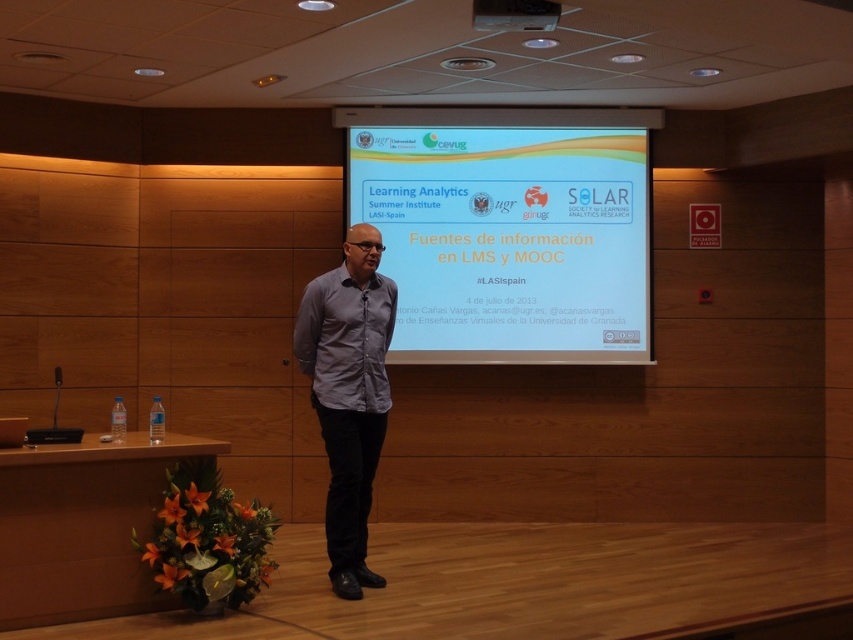
You are an event organizer setting up the conference room. The white glossy projector screen at center and the matte black projector at upper center are both mounted on the wall. Which object is wider?

The white glossy projector screen at center is wider than the matte black projector at upper center.

You are sitting in the audience and want to see both the white glossy projector screen at center and the gray matte shirt at center. Which one appears closer to you?

The white glossy projector screen at center appears closer to you than the gray matte shirt at center because it is further to the viewer.